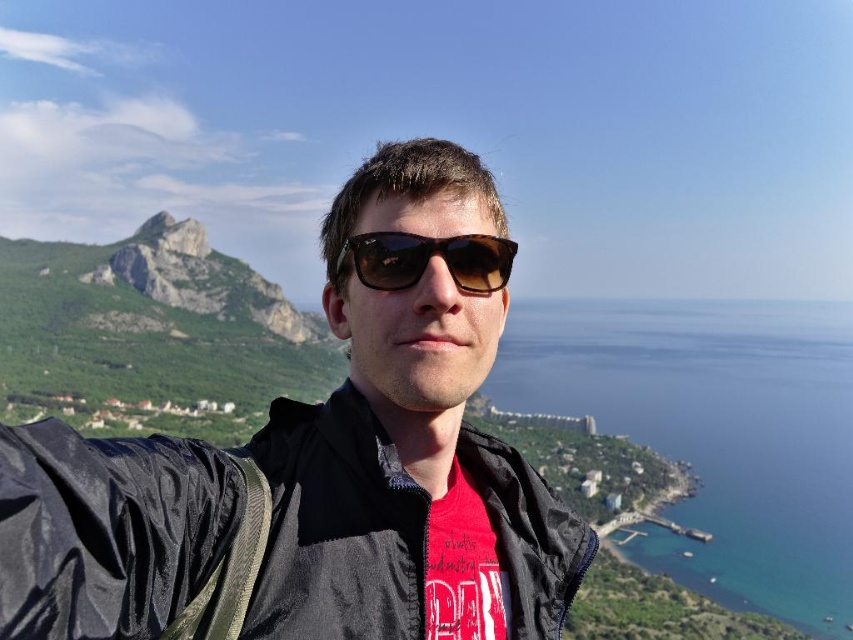
You are a photographer trying to capture the tortoiseshell sunglasses at center and the green rocky mountain at left in a single shot. Based on their positions, which object should you focus on first to ensure both are in clear view?

The photographer should focus on the green rocky mountain at left first because it is closer to the viewer than the tortoiseshell sunglasses at center, ensuring both are in clear view.

You are a photographer planning to capture a landscape photo that includes both the black matte jacket at center and the green rocky mountain at left. Based on their sizes, which object should you focus on first to ensure both are in frame?

The black matte jacket at center is not as tall as the green rocky mountain at left, so you should focus on the green rocky mountain at left first to ensure both are in frame.